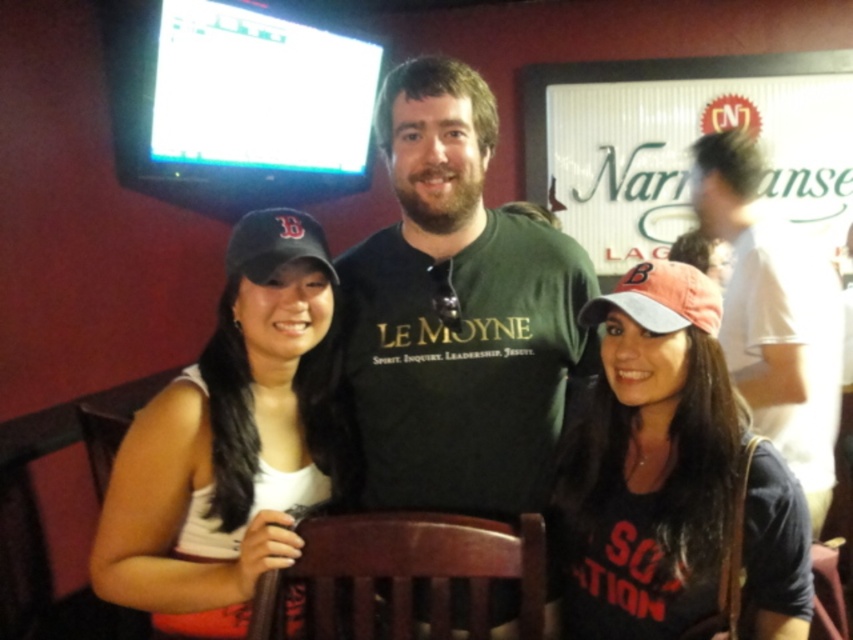
Is white matte baseball cap at left to the right of matte black cap at left from the viewer's perspective?

Incorrect, white matte baseball cap at left is not on the right side of matte black cap at left.

Who is shorter, white matte baseball cap at left or matte black cap at left?

Standing shorter between the two is matte black cap at left.

This screenshot has width=853, height=640. Find the location of `white matte baseball cap at left`. white matte baseball cap at left is located at coordinates (231, 442).

Which is more to the right, pink fabric cap at center or white cotton shirt at upper right?

Positioned to the right is white cotton shirt at upper right.

Who is more forward, (782, 522) or (701, 173)?

Point (782, 522) is in front.

The image size is (853, 640). Find the location of `pink fabric cap at center`. pink fabric cap at center is located at coordinates (648, 461).

Can you confirm if dark green t-shirt at center is positioned to the right of pink fabric cap at center?

In fact, dark green t-shirt at center is to the left of pink fabric cap at center.

Between point (498, 387) and point (654, 508), which one is positioned in front?

Point (654, 508) is more forward.

Identify the location of dark green t-shirt at center. This screenshot has width=853, height=640. (457, 314).

The width and height of the screenshot is (853, 640). What are the coordinates of `dark green t-shirt at center` in the screenshot? It's located at (457, 314).